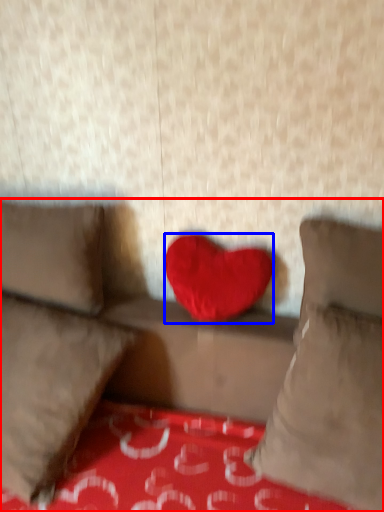
Question: Which object appears closest to the camera in this image, studio couch (highlighted by a red box) or heart (highlighted by a blue box)?

Choices:
 (A) studio couch
 (B) heart

Answer: (A)